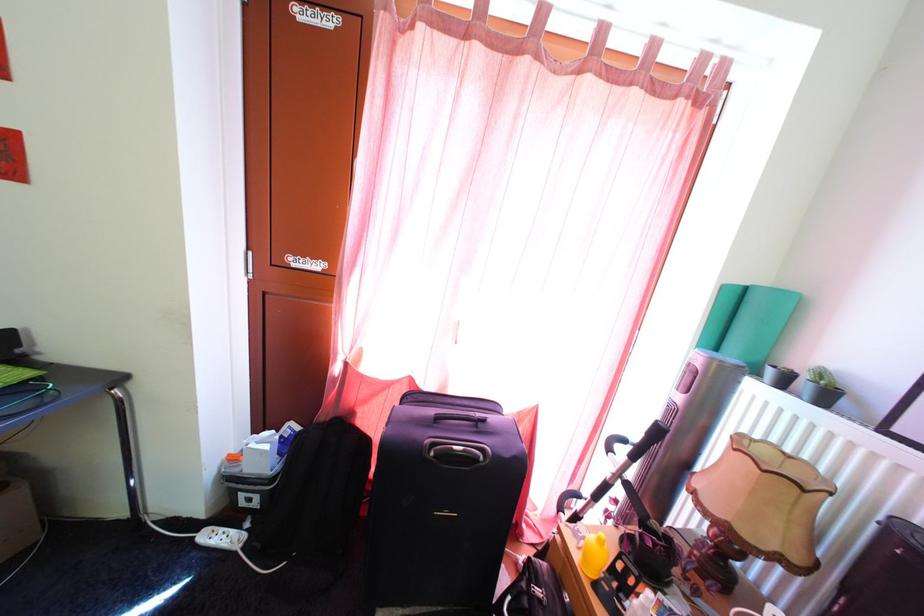
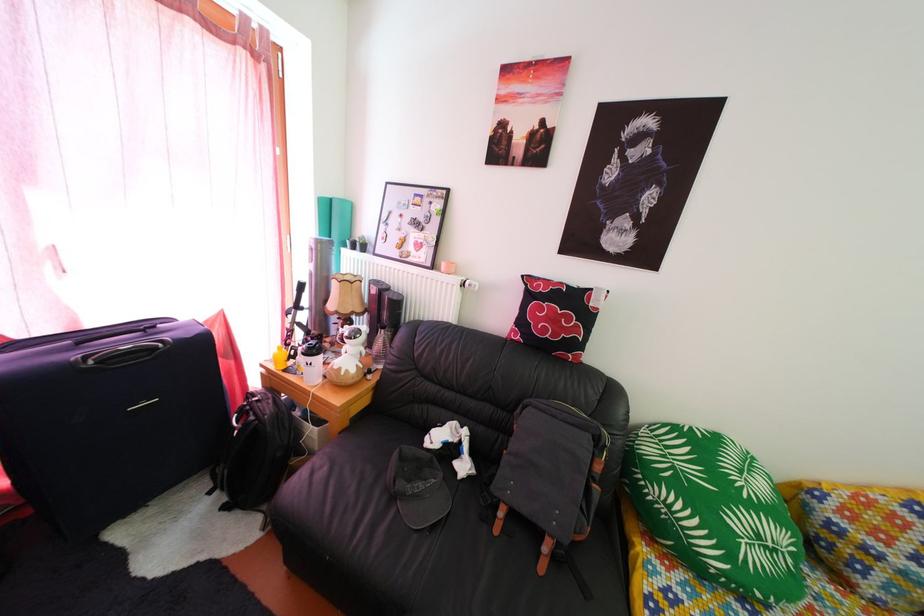
Question: I am providing you with two images of the same scene from different viewpoints. After the viewpoint changes to image2, which objects are now occluded?

Choices:
 (A) black baseball cap
 (B) backpack handle
 (C) radiator valve
 (D) none of these

Answer: (D)